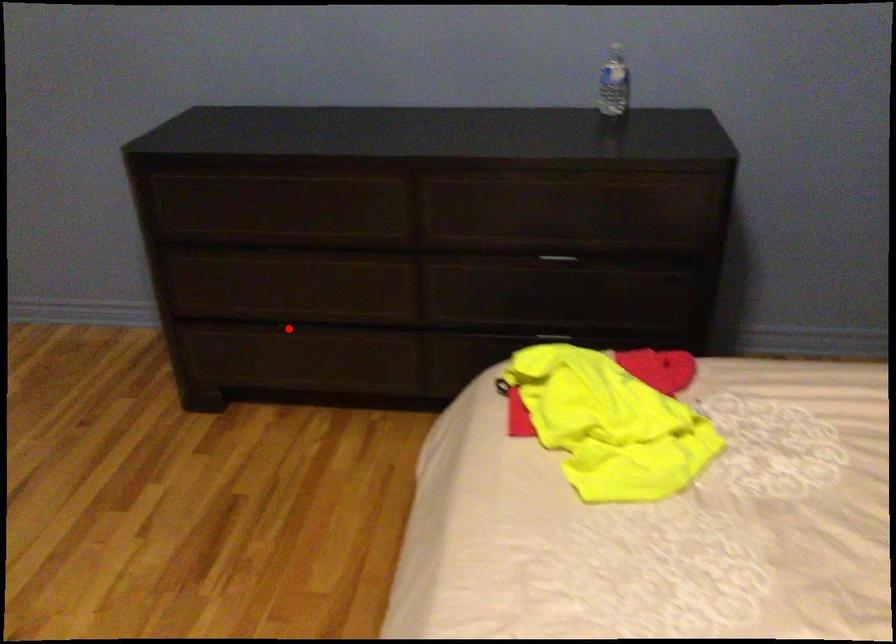
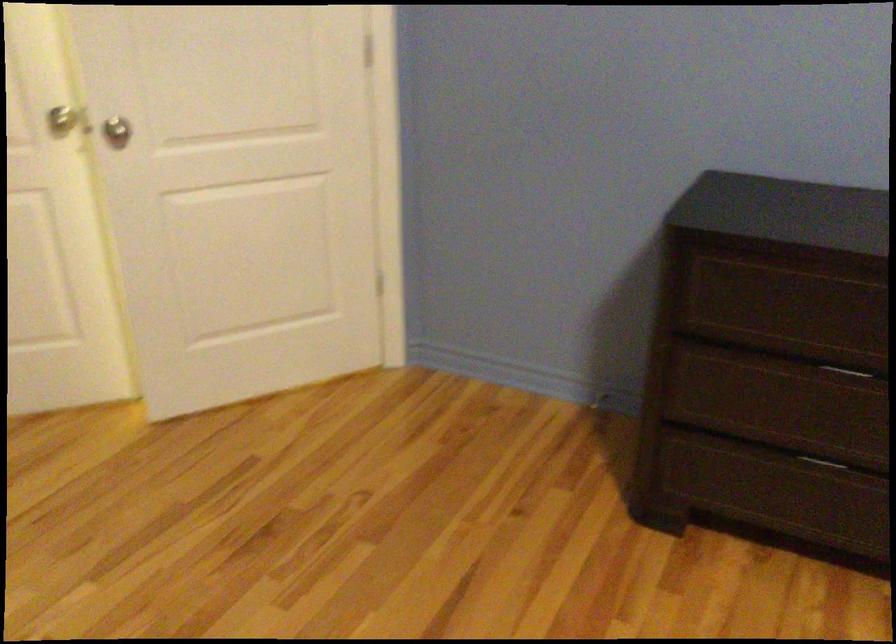
Where in the second image is the point corresponding to the highlighted location from the first image?

(821, 462)